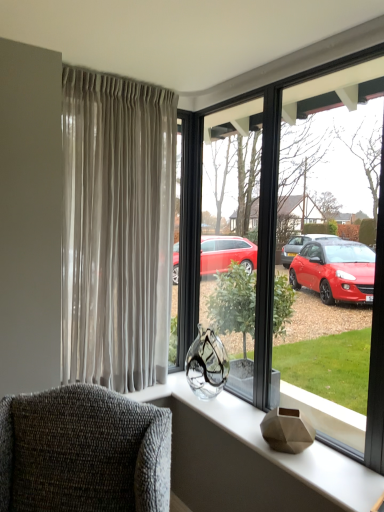
Question: Can you confirm if satin beige curtains at left is shorter than matte gray vase at center?

Choices:
 (A) yes
 (B) no

Answer: (B)

Question: Is satin beige curtains at left further to the viewer compared to matte gray vase at center?

Choices:
 (A) no
 (B) yes

Answer: (B)

Question: From a real-world perspective, is satin beige curtains at left on top of matte gray vase at center?

Choices:
 (A) no
 (B) yes

Answer: (B)

Question: Is there a large distance between satin beige curtains at left and matte gray vase at center?

Choices:
 (A) no
 (B) yes

Answer: (A)

Question: Is satin beige curtains at left not inside matte gray vase at center?

Choices:
 (A) no
 (B) yes

Answer: (B)

Question: Is satin beige curtains at left to the left or to the right of matte gray vase at center in the image?

Choices:
 (A) left
 (B) right

Answer: (A)

Question: From their relative heights in the image, would you say satin beige curtains at left is taller or shorter than matte gray vase at center?

Choices:
 (A) short
 (B) tall

Answer: (B)

Question: In terms of size, does satin beige curtains at left appear bigger or smaller than matte gray vase at center?

Choices:
 (A) small
 (B) big

Answer: (B)

Question: Is satin beige curtains at left inside or outside of matte gray vase at center?

Choices:
 (A) inside
 (B) outside

Answer: (B)

Question: From their relative heights in the image, would you say satin beige curtains at left is taller or shorter than transparent glass vase at center?

Choices:
 (A) tall
 (B) short

Answer: (B)

Question: Is satin beige curtains at left wider or thinner than transparent glass vase at center?

Choices:
 (A) wide
 (B) thin

Answer: (A)

Question: Based on their sizes in the image, would you say satin beige curtains at left is bigger or smaller than transparent glass vase at center?

Choices:
 (A) big
 (B) small

Answer: (A)

Question: From the image's perspective, is satin beige curtains at left above or below transparent glass vase at center?

Choices:
 (A) below
 (B) above

Answer: (B)

Question: Considering the relative positions of textured gray armchair at lower left and satin beige curtains at left in the image provided, is textured gray armchair at lower left to the left or to the right of satin beige curtains at left?

Choices:
 (A) left
 (B) right

Answer: (A)

Question: From the image's perspective, is textured gray armchair at lower left above or below satin beige curtains at left?

Choices:
 (A) below
 (B) above

Answer: (A)